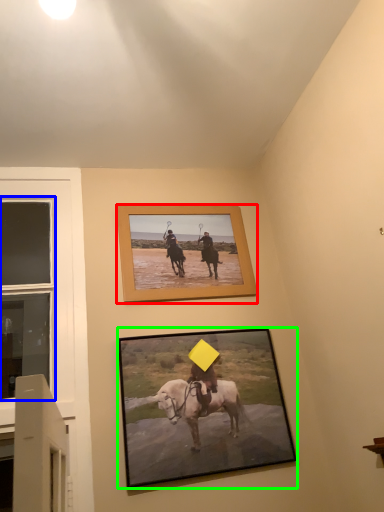
Question: Based on their relative distances, which object is nearer to picture frame (highlighted by a red box)? Choose from window (highlighted by a blue box) and picture frame (highlighted by a green box).

Choices:
 (A) window
 (B) picture frame

Answer: (B)